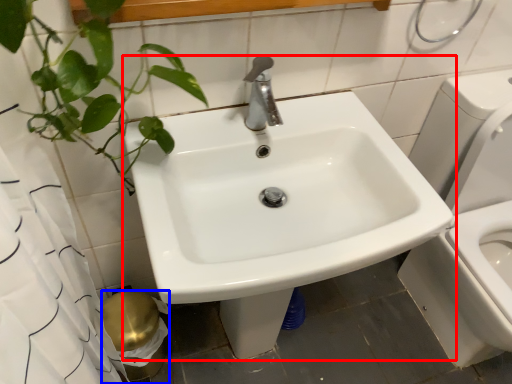
Question: Among these objects, which one is nearest to the camera, sink (highlighted by a red box) or toilet paper (highlighted by a blue box)?

Choices:
 (A) sink
 (B) toilet paper

Answer: (A)